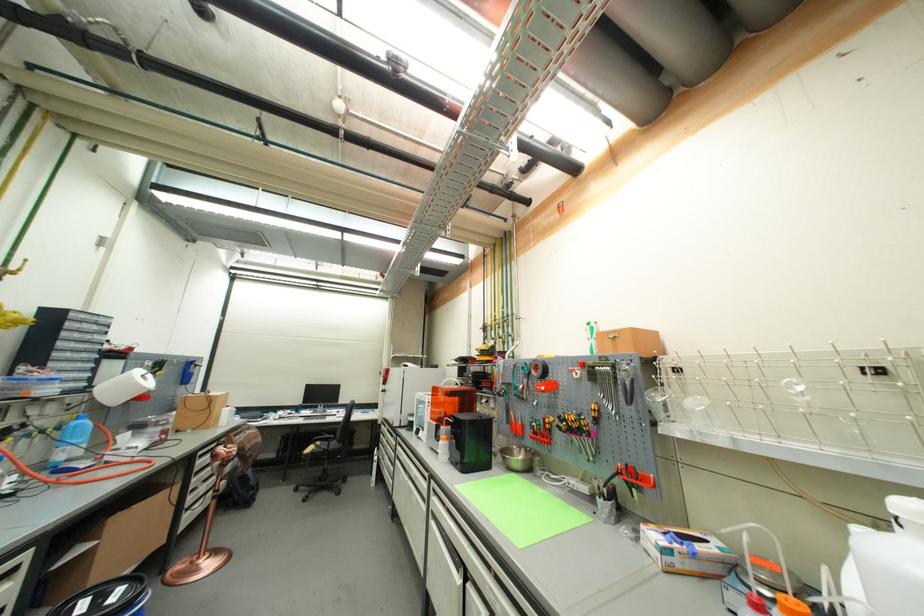
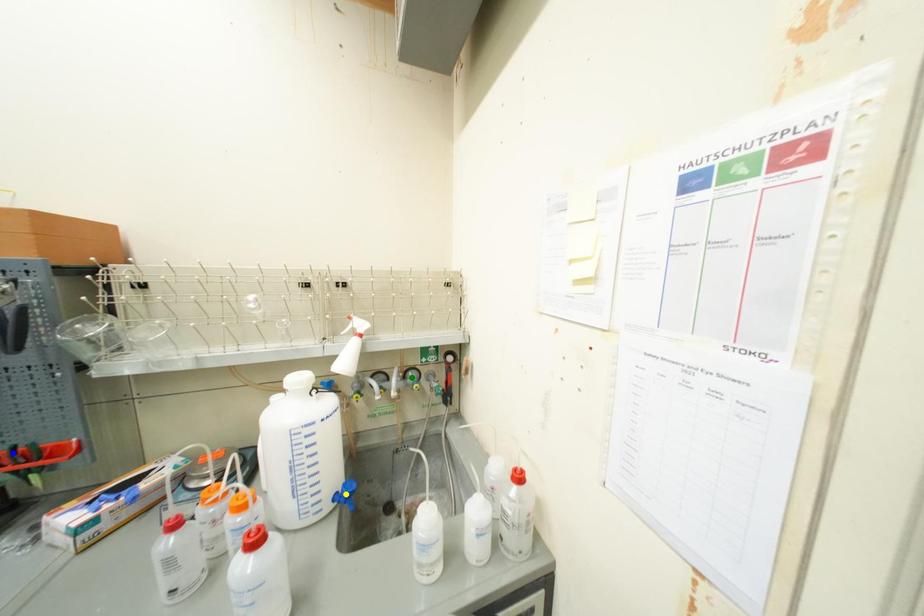
Question: I am providing you with two images of the same scene from different viewpoints. A red point is marked on the first image. You are given multiple points on the second image. Which point in image 2 represents the same 3d spot as the red point in image 1?

Choices:
 (A) green point
 (B) blue point
 (C) yellow point

Answer: (B)